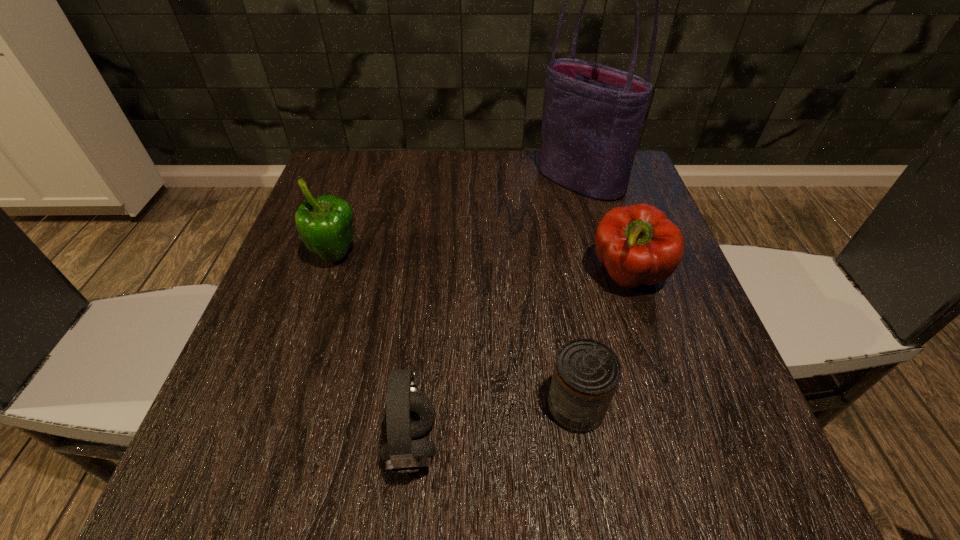
You are a GUI agent. You are given a task and a screenshot of the screen. Output one action in this format:
    pyautogui.click(x=<x>, y=<y>)
    Task: Click on the vacant space situated on the back of the shortest object
    This screenshot has width=960, height=540.
    Given the screenshot: What is the action you would take?
    pyautogui.click(x=556, y=281)

Image resolution: width=960 pixels, height=540 pixels. What are the coordinates of `object present at the far edge` in the screenshot? It's located at (592, 118).

Locate an element on the screen. object situated at the near edge is located at coordinates coord(408,413).

This screenshot has width=960, height=540. In order to click on object positioned at the left edge in this screenshot , I will do `click(325, 223)`.

This screenshot has height=540, width=960. I want to click on tote bag that is at the right edge, so click(592, 118).

The width and height of the screenshot is (960, 540). Identify the location of bell pepper located at the right edge. (638, 245).

At what (x,y) coordinates should I click in order to perform the action: click on object present at the far right corner. Please return your answer as a coordinate pair (x, y). The image size is (960, 540). Looking at the image, I should click on (592, 118).

Find the location of a particular element. This screenshot has height=540, width=960. vacant space at the far edge is located at coordinates (399, 192).

In the image, there is a desktop. Where is `blank space at the near edge`? Image resolution: width=960 pixels, height=540 pixels. blank space at the near edge is located at coordinates (481, 507).

Locate an element on the screen. Image resolution: width=960 pixels, height=540 pixels. free region at the left edge of the desktop is located at coordinates (249, 412).